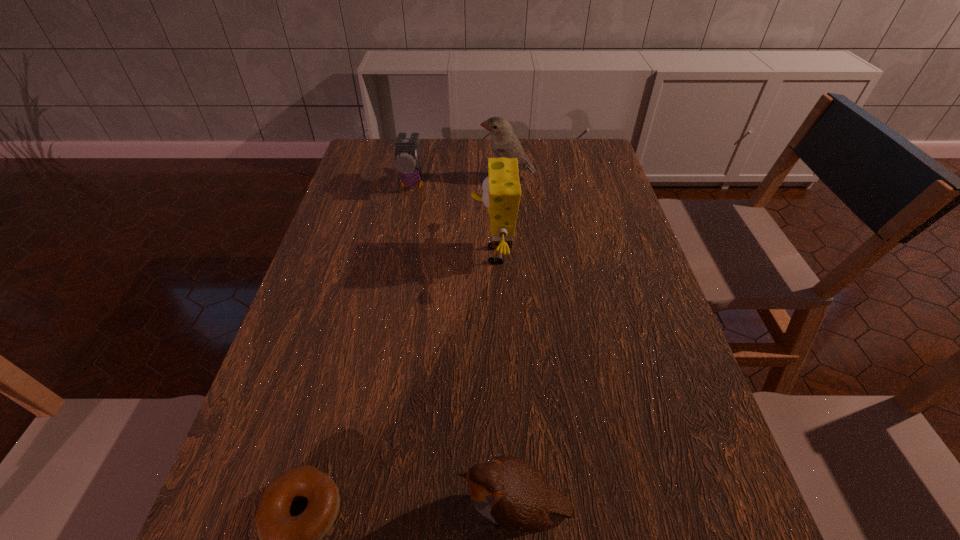
At what (x,y) coordinates should I click in order to perform the action: click on free space located at the beak of the leftmost bird. Please return your answer as a coordinate pair (x, y). The width and height of the screenshot is (960, 540). Looking at the image, I should click on (403, 233).

The image size is (960, 540). Find the location of `vacant point at the far edge`. vacant point at the far edge is located at coordinates (468, 168).

The width and height of the screenshot is (960, 540). I want to click on free space at the left edge, so click(x=264, y=411).

This screenshot has height=540, width=960. In order to click on vacant space at the right edge of the desktop in this screenshot , I will do `click(683, 535)`.

Find the location of a particular element. The width and height of the screenshot is (960, 540). vacant space at the far left corner of the desktop is located at coordinates (376, 170).

Where is `vacant space that is in between the tallest bird and the leftmost bird`? This screenshot has width=960, height=540. vacant space that is in between the tallest bird and the leftmost bird is located at coordinates (460, 181).

Identify the location of free space between the leftmost bird and the tallest bird. (460, 181).

Identify which object is the fourth nearest to the third farthest object. Please provide its 2D coordinates. Your answer should be formatted as a tuple, i.e. [(x, y)], where the tuple contains the x and y coordinates of a point satisfying the conditions above.

[(284, 539)]

Where is `the second closest object relative to the fourth shortest object`? The image size is (960, 540). the second closest object relative to the fourth shortest object is located at coordinates (501, 189).

This screenshot has width=960, height=540. I want to click on the second closest bird to the bagel, so click(406, 161).